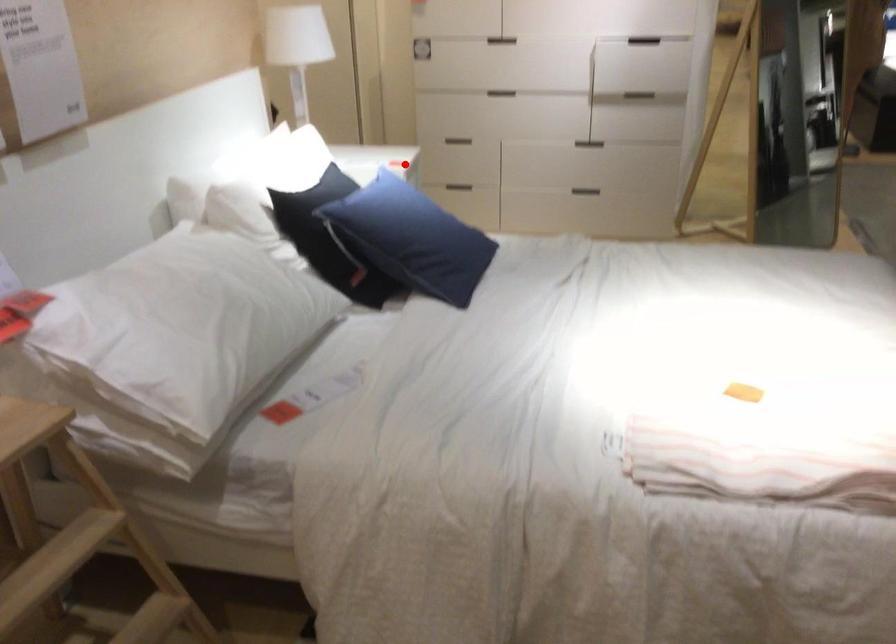
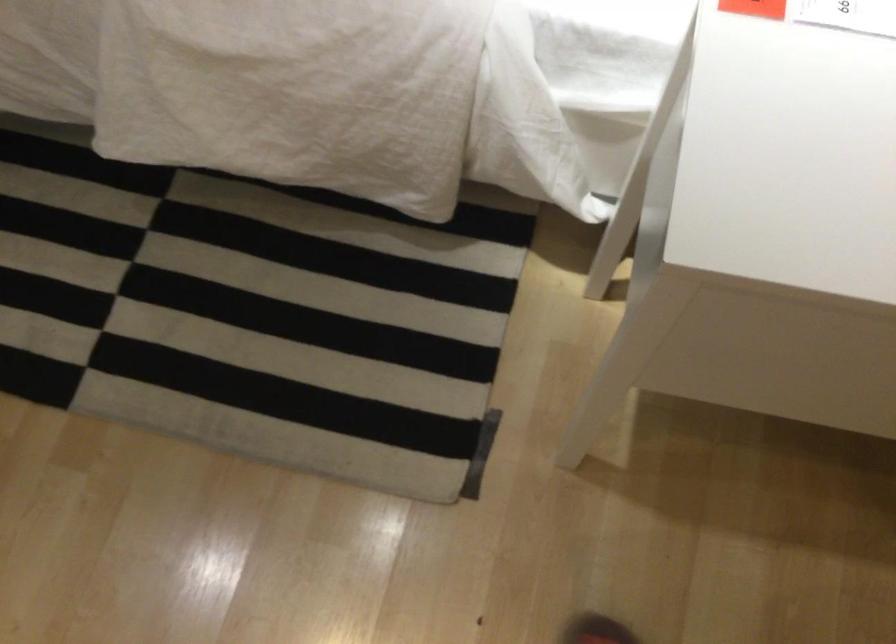
In the second image, find the point that corresponds to the highlighted location in the first image.

(754, 8)